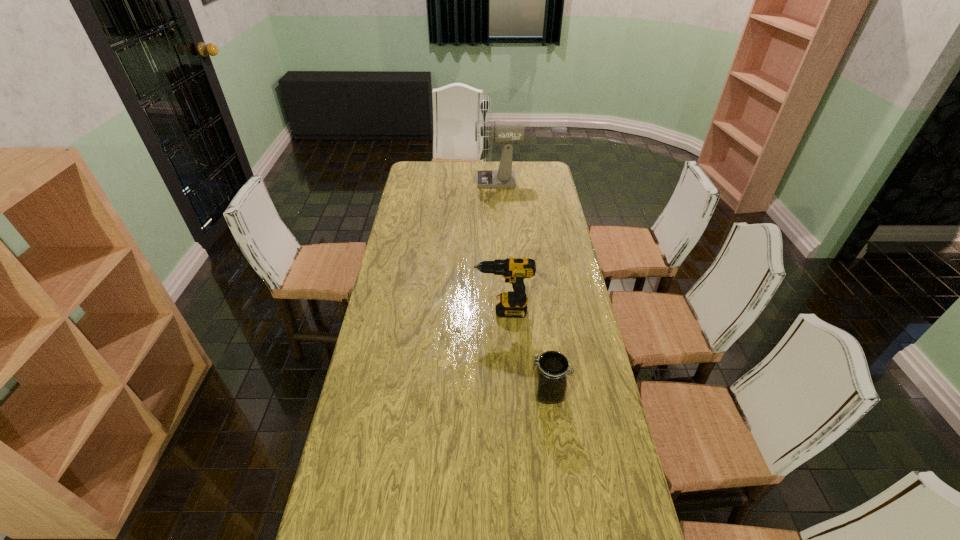
Identify the location of the tallest object. Image resolution: width=960 pixels, height=540 pixels. (501, 131).

Identify the location of fan. (501, 131).

At what (x,y) coordinates should I click in order to perform the action: click on the second shortest object. Please return your answer as a coordinate pair (x, y). Looking at the image, I should click on (x=513, y=304).

The width and height of the screenshot is (960, 540). I want to click on the second nearest object, so click(x=513, y=304).

Find the location of a particular element. The image size is (960, 540). the nearest object is located at coordinates (550, 382).

Where is `jar`? This screenshot has width=960, height=540. jar is located at coordinates (550, 382).

Find the location of a particular element. This screenshot has height=540, width=960. vacant space situated 0.280m on the air flow direction of the farthest object is located at coordinates (421, 180).

The height and width of the screenshot is (540, 960). Find the location of `free spot located 0.150m on the air flow direction of the farthest object`. free spot located 0.150m on the air flow direction of the farthest object is located at coordinates (446, 180).

The width and height of the screenshot is (960, 540). Identify the location of vacant space located 0.230m on the air flow direction of the farthest object. (431, 180).

At what (x,y) coordinates should I click in order to perform the action: click on blank space located 0.060m at the tip of the second farthest object. Please return your answer as a coordinate pair (x, y). Looking at the image, I should click on (458, 310).